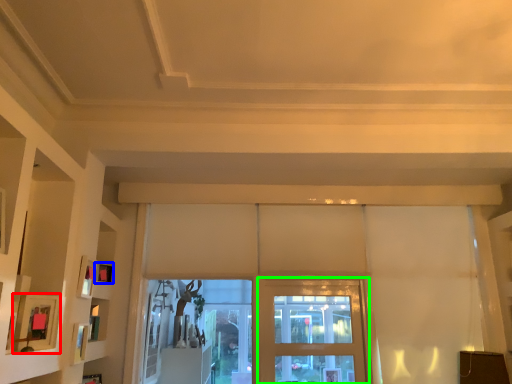
Question: Based on their relative distances, which object is nearer to picture frame (highlighted by a red box)? Choose from picture frame (highlighted by a blue box) and screen door (highlighted by a green box).

Choices:
 (A) picture frame
 (B) screen door

Answer: (A)